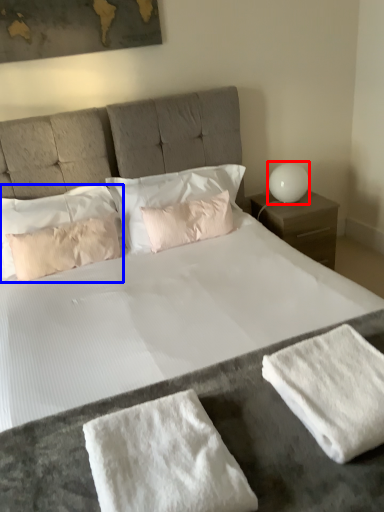
Question: Which object appears closest to the camera in this image, table lamp (highlighted by a red box) or pillow (highlighted by a blue box)?

Choices:
 (A) table lamp
 (B) pillow

Answer: (B)